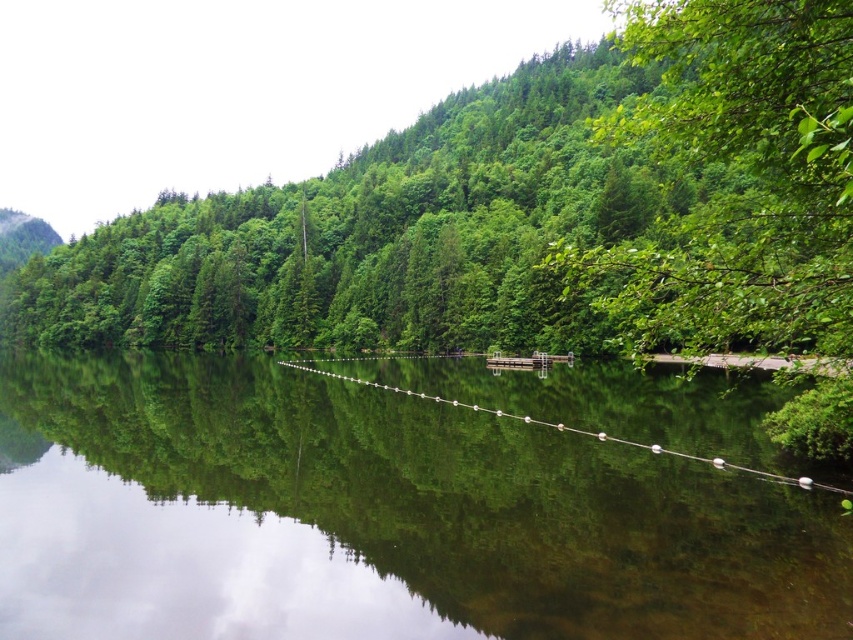
You are standing on the wooden dock on the right side of the lake. You see the clear water at center and the green leafy tree at center. Which object is closer to you?

The clear water at center is closer to you than the green leafy tree at center because the clear water at center is further to the viewer than green leafy tree at center.

You are standing at the edge of the lake and see the point marked at coordinates (374, 516). What is the nature of the water at that specific point?

The clear water at center is located at point (374, 516), so the water at that point is clear.